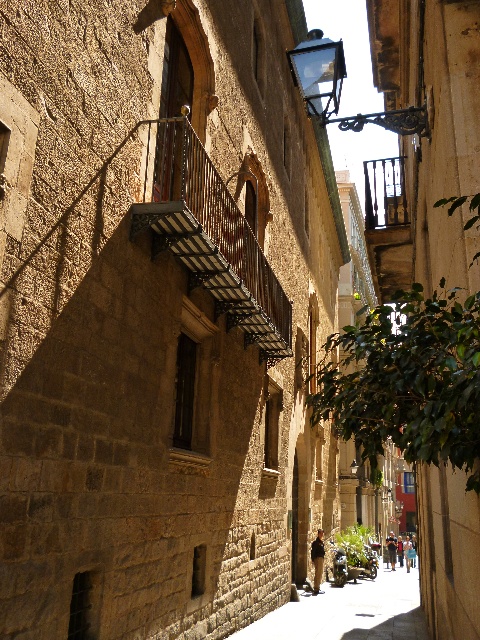
Question: Does smooth stone alley at center appear over clear glass lantern at upper center?

Choices:
 (A) no
 (B) yes

Answer: (A)

Question: Among these points, which one is farthest from the camera?

Choices:
 (A) (303, 636)
 (B) (208, 291)
 (C) (303, 58)
 (D) (375, 224)

Answer: (D)

Question: From the image, what is the correct spatial relationship of smooth stone alley at center in relation to clear glass lantern at upper center?

Choices:
 (A) above
 (B) below

Answer: (B)

Question: Which of the following is the closest to the observer?

Choices:
 (A) wooden at upper center
 (B) clear glass lantern at upper center
 (C) smooth stone alley at center

Answer: (B)

Question: Which object is closer to the camera taking this photo?

Choices:
 (A) wooden at upper center
 (B) smooth stone alley at center

Answer: (B)

Question: Can you confirm if smooth stone alley at center is thinner than clear glass lantern at upper center?

Choices:
 (A) no
 (B) yes

Answer: (A)